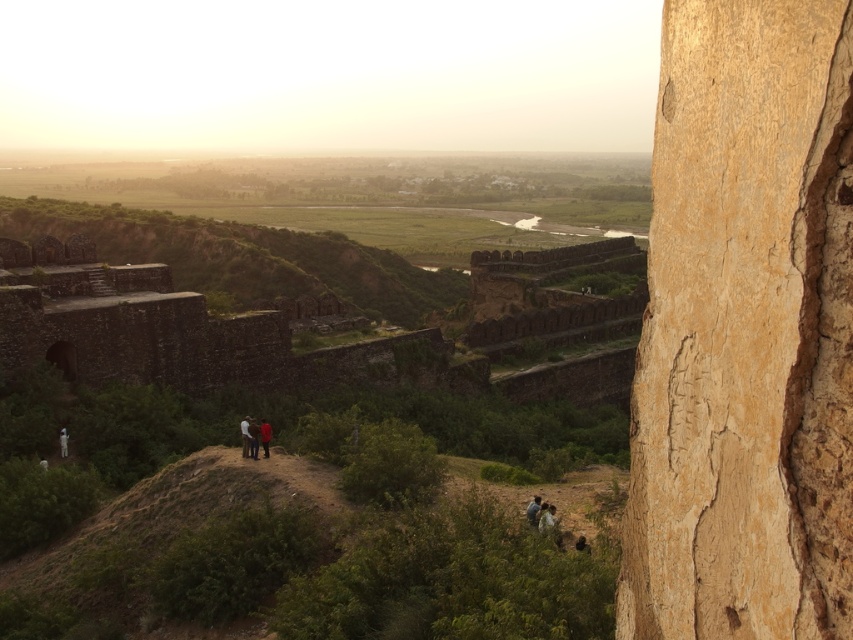
Question: Does smooth beige rock at right appear on the right side of white cotton shirt at lower left?

Choices:
 (A) no
 (B) yes

Answer: (B)

Question: Can you confirm if smooth beige rock at right is positioned below dark blue jeans at center?

Choices:
 (A) no
 (B) yes

Answer: (A)

Question: Can you confirm if dark blue shirt at center is wider than white cotton shirt at lower left?

Choices:
 (A) yes
 (B) no

Answer: (A)

Question: Which object is farther from the camera taking this photo?

Choices:
 (A) white cotton shirt at lower left
 (B) dark blue jeans at lower center
 (C) dark blue shirt at center
 (D) smooth beige rock at right

Answer: (A)

Question: Which point is farther to the camera?

Choices:
 (A) dark blue jeans at lower center
 (B) dark blue shirt at center
 (C) dark blue jeans at center

Answer: (C)

Question: Which object appears closest to the camera in this image?

Choices:
 (A) dark blue shirt at center
 (B) dark blue jeans at center
 (C) dark blue jeans at lower center
 (D) white cotton shirt at lower left

Answer: (C)